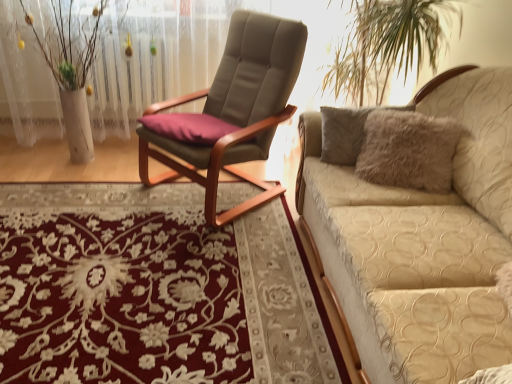
Locate an element on the screen. The image size is (512, 384). free space in front of suede-like beige chair at center is located at coordinates (200, 258).